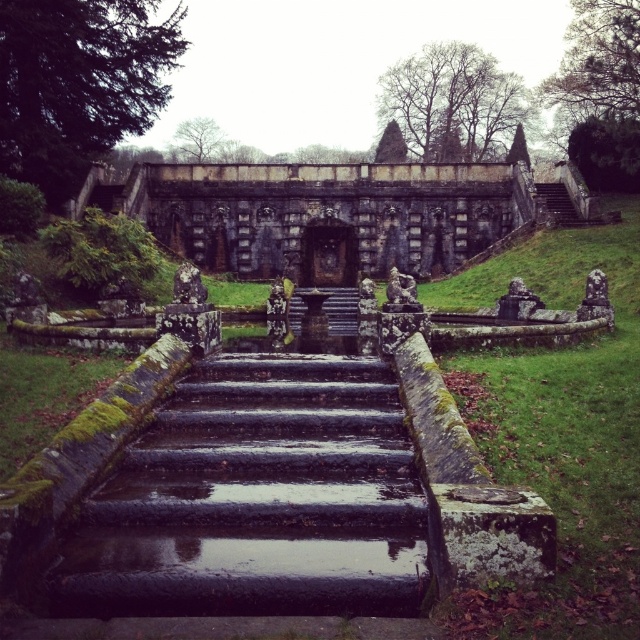
Can you confirm if slate gray stone lion at center is thinner than green stone statue at center?

Correct, slate gray stone lion at center's width is less than green stone statue at center's.

Does slate gray stone lion at center come behind green stone statue at center?

Yes, it is behind green stone statue at center.

Locate an element on the screen. The height and width of the screenshot is (640, 640). slate gray stone lion at center is located at coordinates (516, 301).

Who is taller, mossy stone stairs at center or rustic stone statue at center?

mossy stone stairs at center is taller.

Between mossy stone stairs at center and rustic stone statue at center, which one is positioned lower?

Positioned lower is mossy stone stairs at center.

Describe the element at coordinates (257, 499) in the screenshot. I see `mossy stone stairs at center` at that location.

Locate an element on the screen. This screenshot has height=640, width=640. mossy stone stairs at center is located at coordinates (257, 499).

How far apart are rustic stone statue at upper right and slate gray stone lion at center?

A distance of 8.94 meters exists between rustic stone statue at upper right and slate gray stone lion at center.

Is point (586, 301) behind point (506, 296)?

That is False.

This screenshot has height=640, width=640. Identify the location of rustic stone statue at upper right. (595, 298).